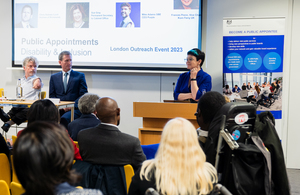
Locate an element on the screen. This screenshot has height=195, width=300. floor is located at coordinates (294, 180).